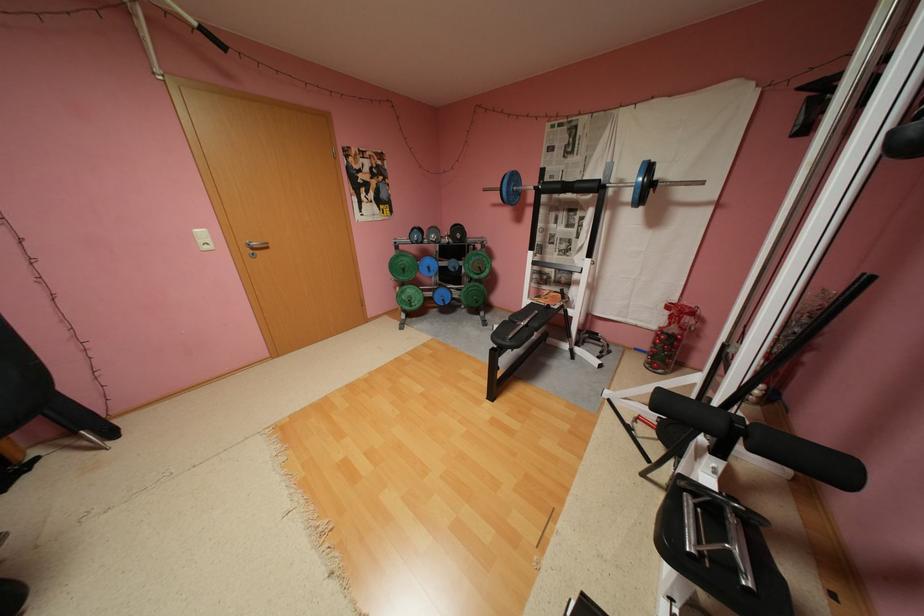
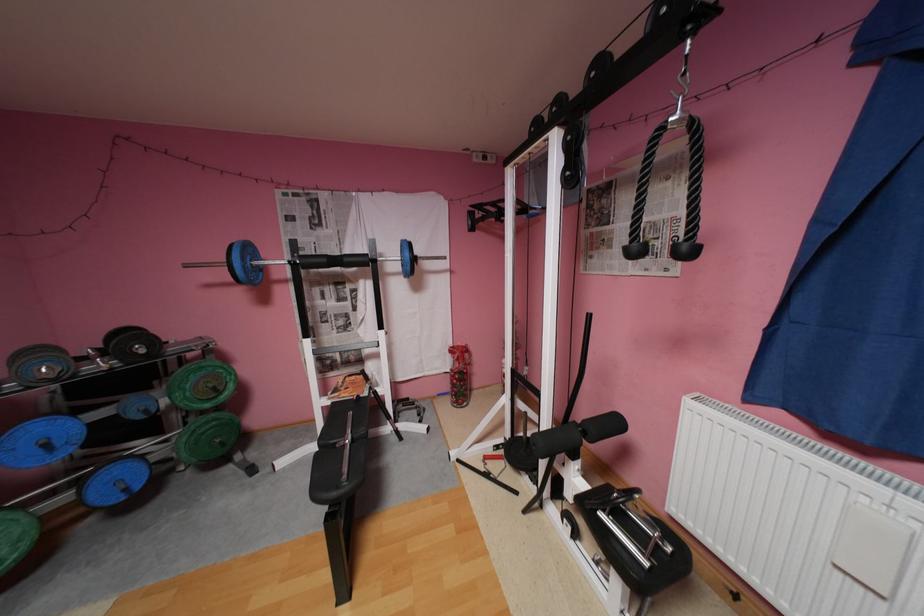
Find the pixel in the second image that matches (666,334) in the first image.

(462, 377)